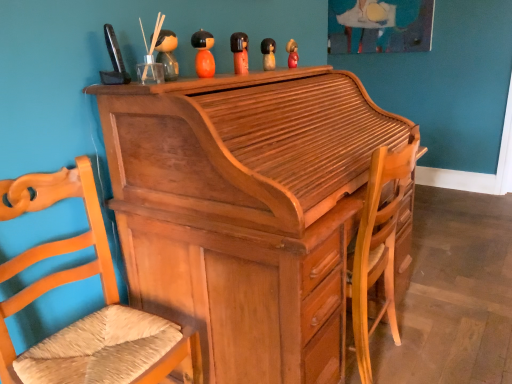
You are a GUI agent. You are given a task and a screenshot of the screen. Output one action in this format:
    pyautogui.click(x=<x>, y=<y>)
    Task: Click on the free spot to the right of orange matte wooden doll at upper center, the 4th toy when ordered from back to front
    The width and height of the screenshot is (512, 384).
    Given the screenshot: What is the action you would take?
    pyautogui.click(x=237, y=74)